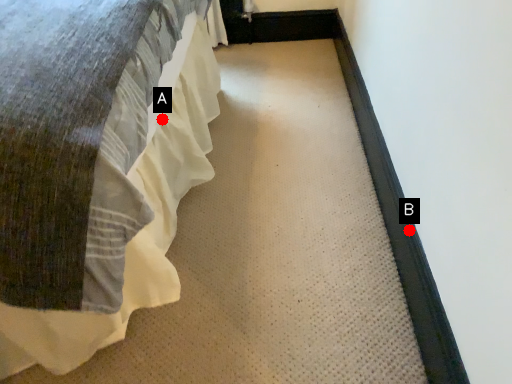
Question: Two points are circled on the image, labeled by A and B beside each circle. Among these points, which one is nearest to the camera?

Choices:
 (A) A is closer
 (B) B is closer

Answer: (B)